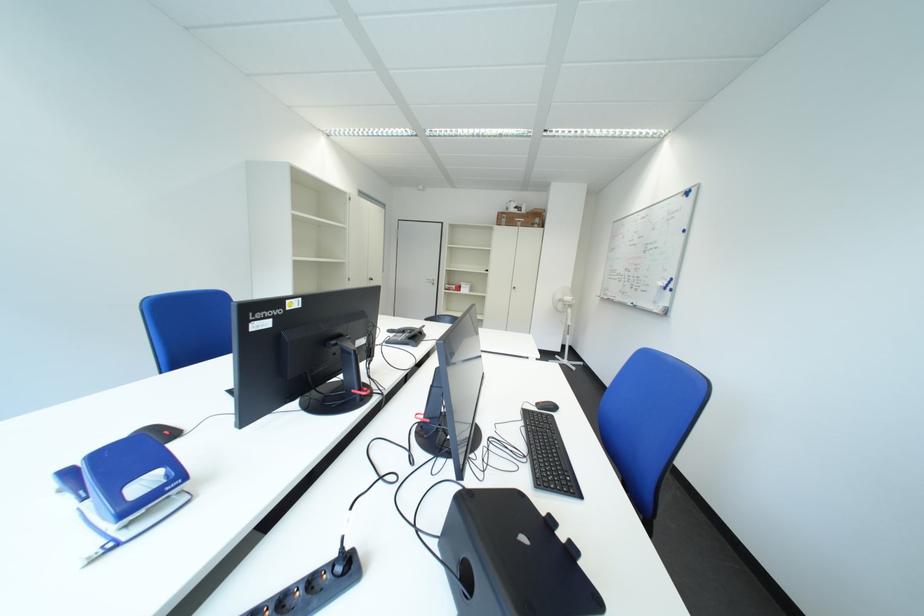
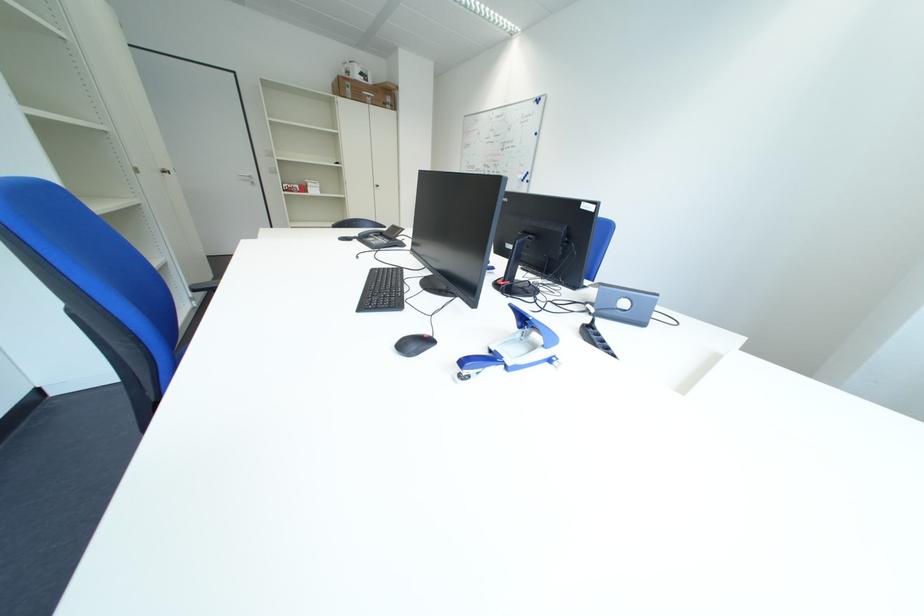
In the second image, find the point that corresponds to pixel 536 214 in the first image.

(383, 84)